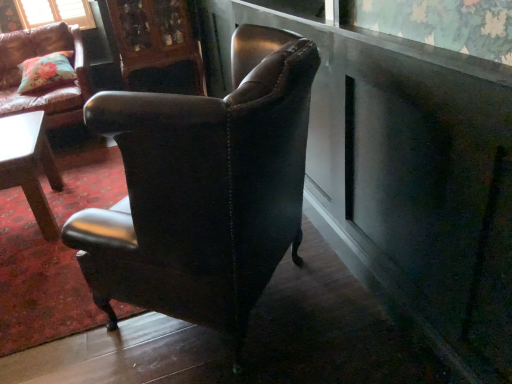
You are a GUI agent. You are given a task and a screenshot of the screen. Output one action in this format:
    pyautogui.click(x=<x>, y=<y>)
    Task: Click on the floral fabric pillow at upper left
    This screenshot has height=384, width=512.
    Given the screenshot: What is the action you would take?
    pyautogui.click(x=46, y=72)

Locate an element on the screen. wooden carved cabinet at upper center is located at coordinates (158, 46).

Where is `leather cushioned armchair at upper left, which ranks as the 1th chair in left-to-right order`? Image resolution: width=512 pixels, height=384 pixels. leather cushioned armchair at upper left, which ranks as the 1th chair in left-to-right order is located at coordinates [x=48, y=89].

Between wooden carved cabinet at upper center and floral fabric pillow at upper left, which one appears on the left side from the viewer's perspective?

floral fabric pillow at upper left is more to the left.

Find the location of `armoire behind the floral fabric pillow at upper left`. armoire behind the floral fabric pillow at upper left is located at coordinates (158, 46).

Would you say wooden carved cabinet at upper center is a long distance from floral fabric pillow at upper left?

No, wooden carved cabinet at upper center is not far away from floral fabric pillow at upper left.

Is point (163, 36) closer or farther from the camera than point (166, 229)?

Clearly, point (163, 36) is more distant from the camera than point (166, 229).

From a real-world perspective, who is located lower, wooden carved cabinet at upper center or matte brown leather chair at center, the first chair positioned from the front?

matte brown leather chair at center, the first chair positioned from the front, from a real-world perspective.

There is a wooden carved cabinet at upper center. In order to click on the 1st chair below it (from a real-world perspective) in this screenshot , I will do `click(204, 189)`.

What's the angular difference between wooden carved cabinet at upper center and matte brown leather chair at center, acting as the 1th chair starting from the right,'s facing directions?

The facing directions of wooden carved cabinet at upper center and matte brown leather chair at center, acting as the 1th chair starting from the right, are 132 degrees apart.

Between matte brown leather chair at center, acting as the 2th chair starting from the back, and wooden carved cabinet at upper center, which one is positioned in front?

matte brown leather chair at center, acting as the 2th chair starting from the back, is more forward.

Does matte brown leather chair at center, acting as the 1th chair starting from the right, have a greater height compared to wooden carved cabinet at upper center?

In fact, matte brown leather chair at center, acting as the 1th chair starting from the right, may be shorter than wooden carved cabinet at upper center.

Considering the relative sizes of matte brown leather chair at center, acting as the 1th chair starting from the right, and wooden carved cabinet at upper center in the image provided, is matte brown leather chair at center, acting as the 1th chair starting from the right, wider than wooden carved cabinet at upper center?

Correct, the width of matte brown leather chair at center, acting as the 1th chair starting from the right, exceeds that of wooden carved cabinet at upper center.

Is wooden carved cabinet at upper center located within matte brown leather chair at center, the second chair from the left?

Definitely not — wooden carved cabinet at upper center is not inside matte brown leather chair at center, the second chair from the left.

From a real-world perspective, is floral fabric pillow at upper left over wooden carved cabinet at upper center?

Yes.

Between floral fabric pillow at upper left and wooden carved cabinet at upper center, which one has smaller size?

floral fabric pillow at upper left.

Considering the positions of objects floral fabric pillow at upper left and wooden carved cabinet at upper center in the image provided, who is more to the left, floral fabric pillow at upper left or wooden carved cabinet at upper center?

floral fabric pillow at upper left.

Measure the distance from floral fabric pillow at upper left to wooden carved cabinet at upper center.

A distance of 32.00 inches exists between floral fabric pillow at upper left and wooden carved cabinet at upper center.

Is matte brown leather chair at center, the second chair from the left, positioned behind floral fabric pillow at upper left?

No, it is in front of floral fabric pillow at upper left.

Is matte brown leather chair at center, acting as the 1th chair starting from the right, aimed at floral fabric pillow at upper left?

No, matte brown leather chair at center, acting as the 1th chair starting from the right, is not aimed at floral fabric pillow at upper left.

Does point (260, 183) appear closer or farther from the camera than point (56, 62)?

Point (260, 183).

Based on the photo, how distant is leather cushioned armchair at upper left, marked as the second chair in a front-to-back arrangement, from matte brown leather chair at center, acting as the 2th chair starting from the back?

leather cushioned armchair at upper left, marked as the second chair in a front-to-back arrangement, is 2.21 meters from matte brown leather chair at center, acting as the 2th chair starting from the back.

Considering the relative sizes of leather cushioned armchair at upper left, the 1th chair viewed from the back, and matte brown leather chair at center, acting as the 1th chair starting from the right, in the image provided, is leather cushioned armchair at upper left, the 1th chair viewed from the back, wider than matte brown leather chair at center, acting as the 1th chair starting from the right,?

Yes.

From a real-world perspective, is leather cushioned armchair at upper left, which ranks as the 1th chair in left-to-right order, under matte brown leather chair at center, acting as the 2th chair starting from the back?

Yes.

Is leather cushioned armchair at upper left, marked as the second chair in a front-to-back arrangement, aimed at matte brown leather chair at center, the second chair from the left?

Yes, leather cushioned armchair at upper left, marked as the second chair in a front-to-back arrangement, faces towards matte brown leather chair at center, the second chair from the left.

Which is closer, (44,61) or (229,122)?

Point (44,61).

Is floral fabric pillow at upper left positioned with its back to matte brown leather chair at center, the first chair positioned from the front?

No.

From the image's perspective, is floral fabric pillow at upper left located beneath matte brown leather chair at center, the first chair positioned from the front?

No.

Is floral fabric pillow at upper left inside the boundaries of matte brown leather chair at center, acting as the 2th chair starting from the back, or outside?

floral fabric pillow at upper left is located beyond the bounds of matte brown leather chair at center, acting as the 2th chair starting from the back.

I want to click on armoire behind the floral fabric pillow at upper left, so click(158, 46).

This screenshot has width=512, height=384. In the image, there is a matte brown leather chair at center, acting as the 1th chair starting from the right. Find the location of `armoire above it (from the image's perspective)`. armoire above it (from the image's perspective) is located at coordinates (158, 46).

Which object lies nearer to the anchor point floral fabric pillow at upper left, leather cushioned armchair at upper left, the 1th chair viewed from the back, or wooden carved cabinet at upper center?

Among the two, leather cushioned armchair at upper left, the 1th chair viewed from the back, is located nearer to floral fabric pillow at upper left.

In the scene shown: From the image, which object appears to be nearer to matte brown leather chair at center, acting as the 2th chair starting from the back, wooden carved cabinet at upper center or floral fabric pillow at upper left?

floral fabric pillow at upper left.

Which object lies further to the anchor point leather cushioned armchair at upper left, marked as the second chair in a front-to-back arrangement, floral fabric pillow at upper left or matte brown leather chair at center, the first chair positioned from the front?

matte brown leather chair at center, the first chair positioned from the front.

When comparing their distances from floral fabric pillow at upper left, does matte brown leather chair at center, the first chair positioned from the front, or leather cushioned armchair at upper left, marked as the second chair in a front-to-back arrangement, seem further?

matte brown leather chair at center, the first chair positioned from the front, is positioned further to the anchor floral fabric pillow at upper left.

Based on their spatial positions, is floral fabric pillow at upper left or leather cushioned armchair at upper left, acting as the 2th chair starting from the right, further from wooden carved cabinet at upper center?

floral fabric pillow at upper left is positioned further to the anchor wooden carved cabinet at upper center.

When comparing their distances from leather cushioned armchair at upper left, marked as the second chair in a front-to-back arrangement, does wooden carved cabinet at upper center or matte brown leather chair at center, the second chair from the left, seem further?

matte brown leather chair at center, the second chair from the left, lies further to leather cushioned armchair at upper left, marked as the second chair in a front-to-back arrangement, than the other object.

Which object lies nearer to the anchor point leather cushioned armchair at upper left, which ranks as the 1th chair in left-to-right order, matte brown leather chair at center, the first chair positioned from the front, or wooden carved cabinet at upper center?

wooden carved cabinet at upper center.

From the image, which object appears to be farther from wooden carved cabinet at upper center, matte brown leather chair at center, the first chair positioned from the front, or leather cushioned armchair at upper left, marked as the second chair in a front-to-back arrangement?

Among the two, matte brown leather chair at center, the first chair positioned from the front, is located further to wooden carved cabinet at upper center.

The image size is (512, 384). I want to click on chair between matte brown leather chair at center, the first chair positioned from the front, and wooden carved cabinet at upper center in the front-back direction, so click(x=48, y=89).

This screenshot has width=512, height=384. In order to click on pillow located between matte brown leather chair at center, acting as the 1th chair starting from the right, and wooden carved cabinet at upper center in the depth direction in this screenshot , I will do pos(46,72).

What are the coordinates of `chair between matte brown leather chair at center, the second chair from the left, and floral fabric pillow at upper left, along the z-axis` in the screenshot? It's located at (48, 89).

What are the coordinates of `pillow located between leather cushioned armchair at upper left, acting as the 2th chair starting from the right, and wooden carved cabinet at upper center in the left-right direction` in the screenshot? It's located at (46, 72).